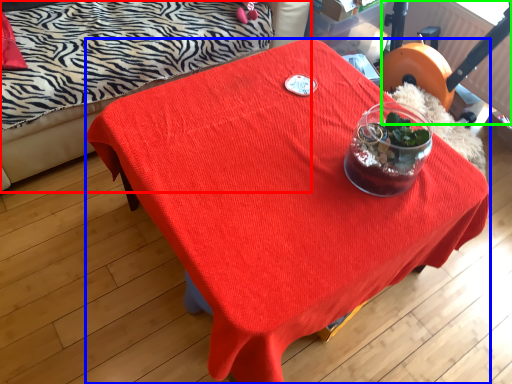
Question: Considering the real-world distances, which object is farthest from studio couch (highlighted by a red box)? desk (highlighted by a blue box) or swivel chair (highlighted by a green box)?

Choices:
 (A) desk
 (B) swivel chair

Answer: (B)